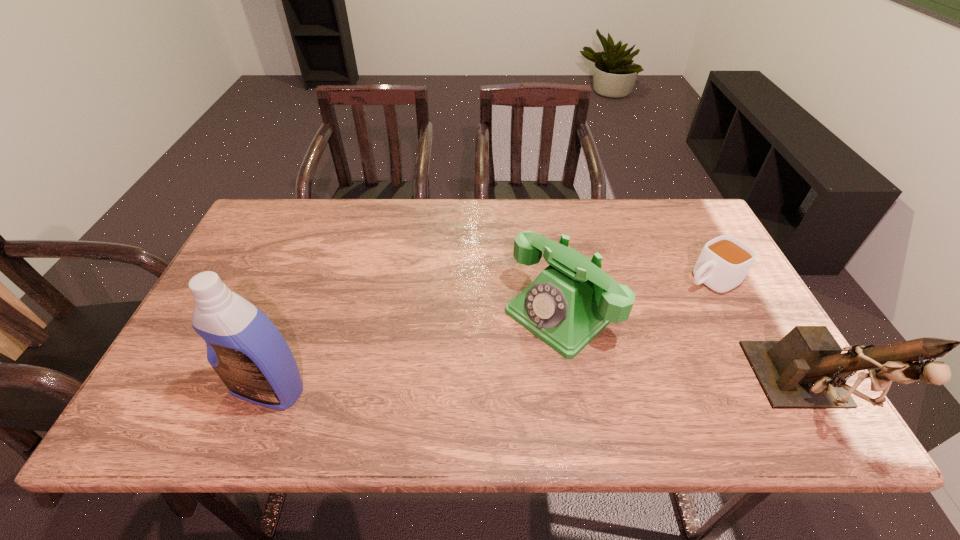
What are the coordinates of `vacant space located on the side with the handle of the shortest object` in the screenshot? It's located at (595, 336).

Locate an element on the screen. The width and height of the screenshot is (960, 540). detergent located at the near edge is located at coordinates (246, 350).

You are a GUI agent. You are given a task and a screenshot of the screen. Output one action in this format:
    pyautogui.click(x=<x>, y=<y>)
    Task: Click on the figurine present at the near edge
    The width and height of the screenshot is (960, 540).
    Given the screenshot: What is the action you would take?
    pyautogui.click(x=806, y=369)

The width and height of the screenshot is (960, 540). I want to click on object that is at the left edge, so click(x=246, y=350).

I want to click on figurine that is at the right edge, so tap(806, 369).

Locate an element on the screen. cup located at the right edge is located at coordinates (724, 261).

This screenshot has width=960, height=540. Find the location of `object that is at the near left corner`. object that is at the near left corner is located at coordinates (246, 350).

Locate an element on the screen. The image size is (960, 540). object positioned at the near right corner is located at coordinates coord(806,369).

This screenshot has height=540, width=960. In order to click on vacant space at the far edge of the desktop in this screenshot , I will do click(400, 224).

Locate an element on the screen. This screenshot has height=540, width=960. free point at the near edge is located at coordinates (489, 376).